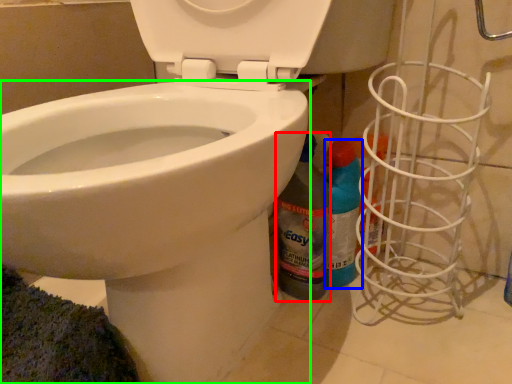
Question: Which object is positioned closest to cleaning product (highlighted by a red box)? Select from cleaning product (highlighted by a blue box) and bidet (highlighted by a green box).

Choices:
 (A) cleaning product
 (B) bidet

Answer: (A)